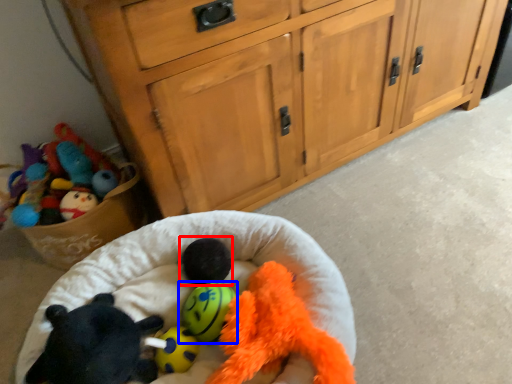
Question: Which object is further to the camera taking this photo, animal (highlighted by a red box) or toy (highlighted by a blue box)?

Choices:
 (A) animal
 (B) toy

Answer: (A)